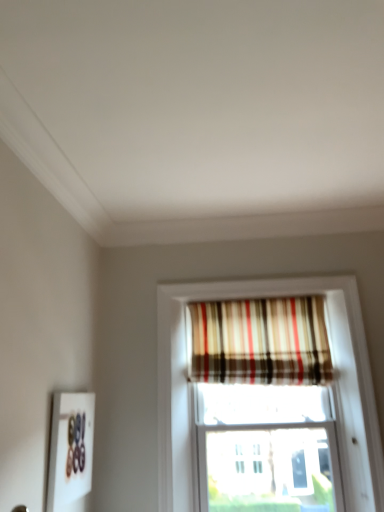
Where is `plaid fabric curtain at upper center`? The image size is (384, 512). plaid fabric curtain at upper center is located at coordinates (259, 341).

What do you see at coordinates (259, 341) in the screenshot? Image resolution: width=384 pixels, height=512 pixels. I see `plaid fabric curtain at upper center` at bounding box center [259, 341].

Measure the distance between plaid fabric curtain at upper center and camera.

The depth of plaid fabric curtain at upper center is 3.11 meters.

At what (x,y) coordinates should I click in order to perform the action: click on plaid fabric curtain at upper center. Please return your answer as a coordinate pair (x, y). The image size is (384, 512). Looking at the image, I should click on (259, 341).